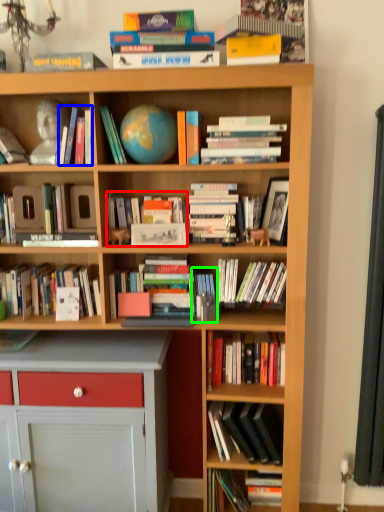
Question: Considering the real-world distances, which object is farthest from book (highlighted by a red box)? book (highlighted by a blue box) or book (highlighted by a green box)?

Choices:
 (A) book
 (B) book

Answer: (A)